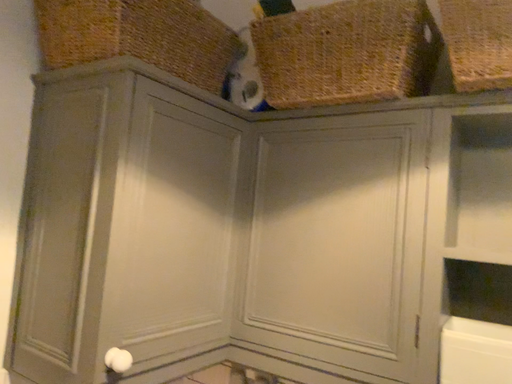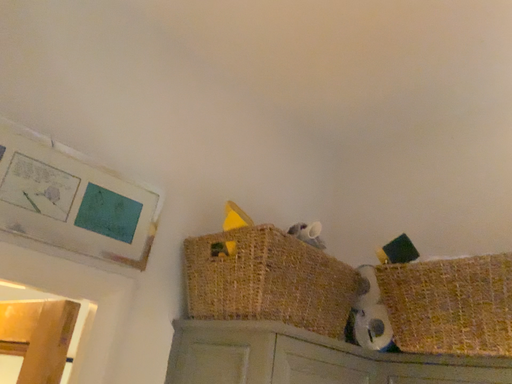
Question: How did the camera likely rotate when shooting the video?

Choices:
 (A) rotated right
 (B) rotated left

Answer: (B)